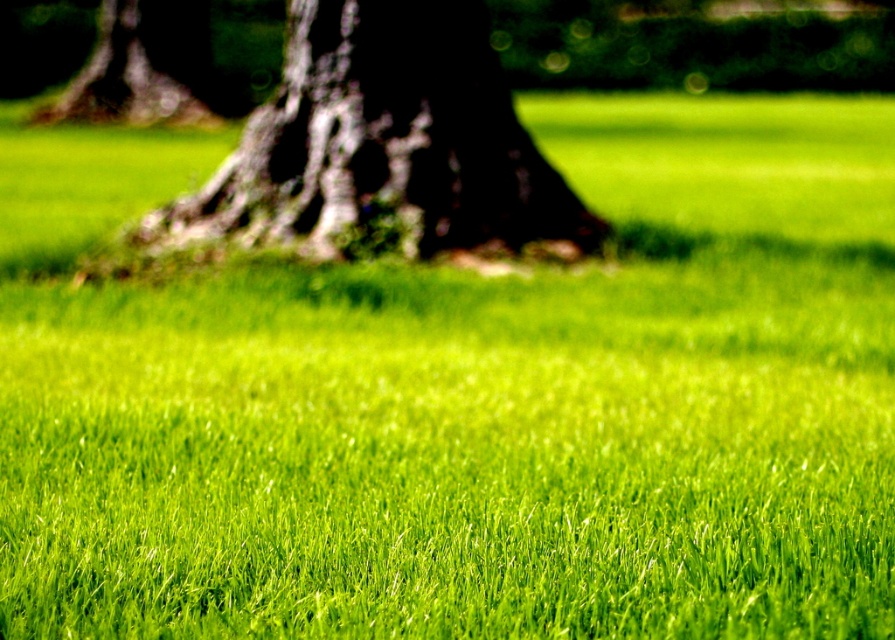
Does dark brown textured trunk at center have a greater height compared to dark brown bark at upper left?

No, dark brown textured trunk at center is not taller than dark brown bark at upper left.

Is dark brown textured trunk at center smaller than dark brown bark at upper left?

Indeed, dark brown textured trunk at center has a smaller size compared to dark brown bark at upper left.

Where is `dark brown textured trunk at center`? The height and width of the screenshot is (640, 895). dark brown textured trunk at center is located at coordinates [382, 141].